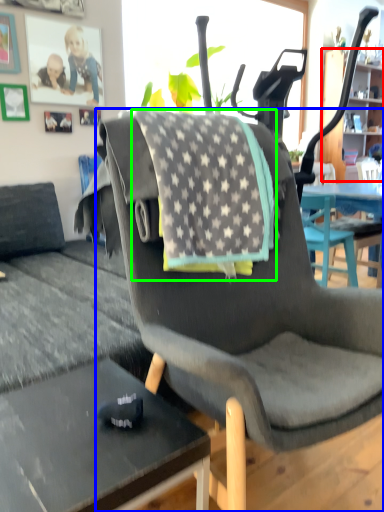
Question: Considering the real-world distances, which object is closest to cabinetry (highlighted by a red box)? chair (highlighted by a blue box) or blanket (highlighted by a green box).

Choices:
 (A) chair
 (B) blanket

Answer: (B)